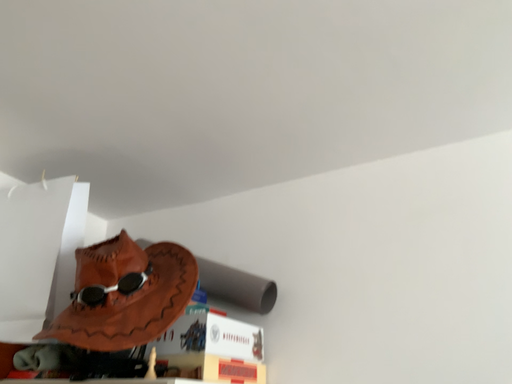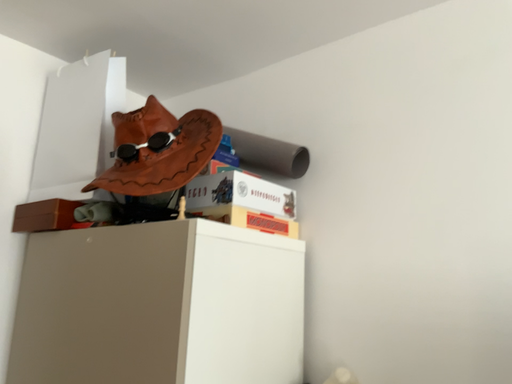
Question: How did the camera likely rotate when shooting the video?

Choices:
 (A) rotated upward
 (B) rotated downward

Answer: (B)